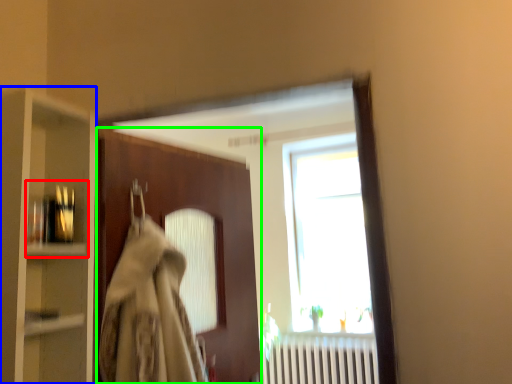
Question: Which object is the farthest from shelf (highlighted by a red box)? Choose among these: cabinetry (highlighted by a blue box) or door (highlighted by a green box).

Choices:
 (A) cabinetry
 (B) door

Answer: (B)